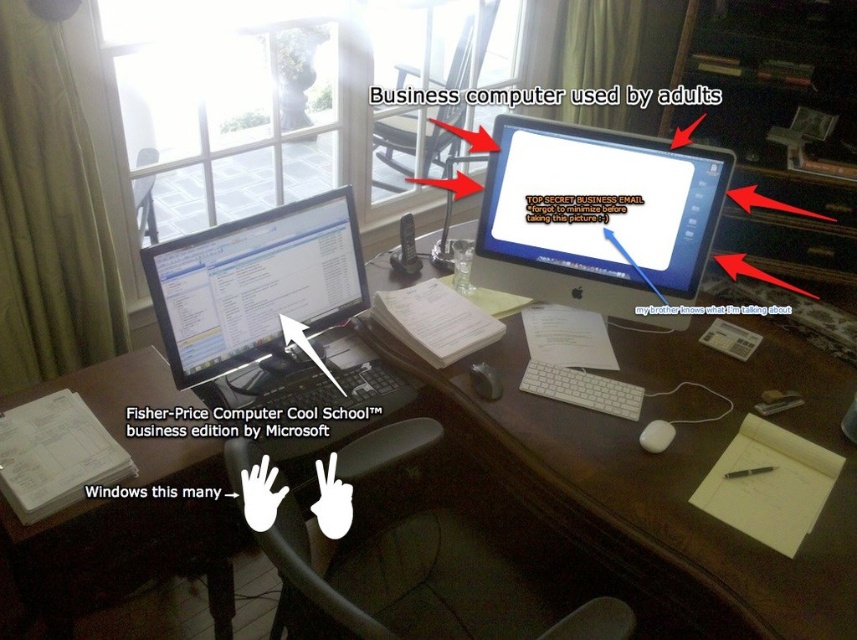
Question: Is the position of matte black monitor at left less distant than that of white matte mouse at center?

Choices:
 (A) yes
 (B) no

Answer: (A)

Question: Among these points, which one is farthest from the camera?

Choices:
 (A) (663, 422)
 (B) (664, 296)

Answer: (B)

Question: Does white glossy monitor at upper center appear under white matte mouse at lower right?

Choices:
 (A) yes
 (B) no

Answer: (B)

Question: Is brown wooden desk at center to the right of white glossy monitor at upper center from the viewer's perspective?

Choices:
 (A) yes
 (B) no

Answer: (A)

Question: Estimate the real-world distances between objects in this image. Which object is closer to the white matte mouse at center?

Choices:
 (A) white plastic keyboard at center
 (B) white matte mouse at lower right
 (C) brown wooden desk at center
 (D) white glossy monitor at upper center

Answer: (A)

Question: Which object is farther from the camera taking this photo?

Choices:
 (A) white matte mouse at center
 (B) white glossy monitor at upper center
 (C) matte black monitor at left
 (D) brown wooden desk at center

Answer: (B)